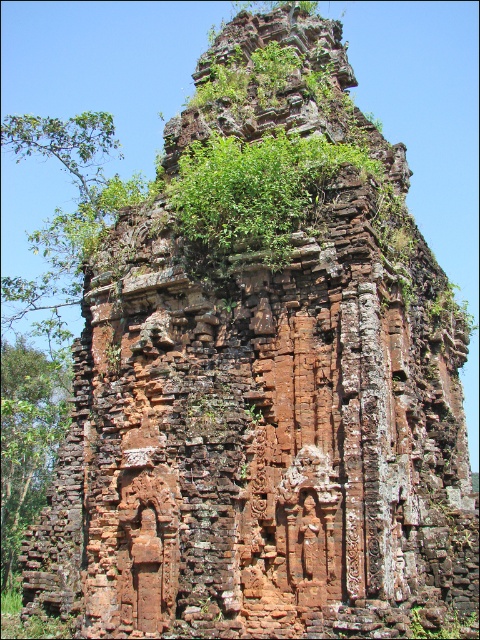
You are standing in front of the ancient stone structure and want to take a photo of the green leafy plant at center and the green leafy tree at left. Which one will appear closer to you in the photo?

The green leafy plant at center will appear closer to you in the photo because it is in front of the green leafy tree at left.

You are an archaeologist examining the ancient stone structure. You notice two green leafy plants here. Which one is shorter between the green leafy plant at center and the green leafy tree at left?

The green leafy plant at center is not as tall as the green leafy tree at left, so the green leafy plant at center is shorter.